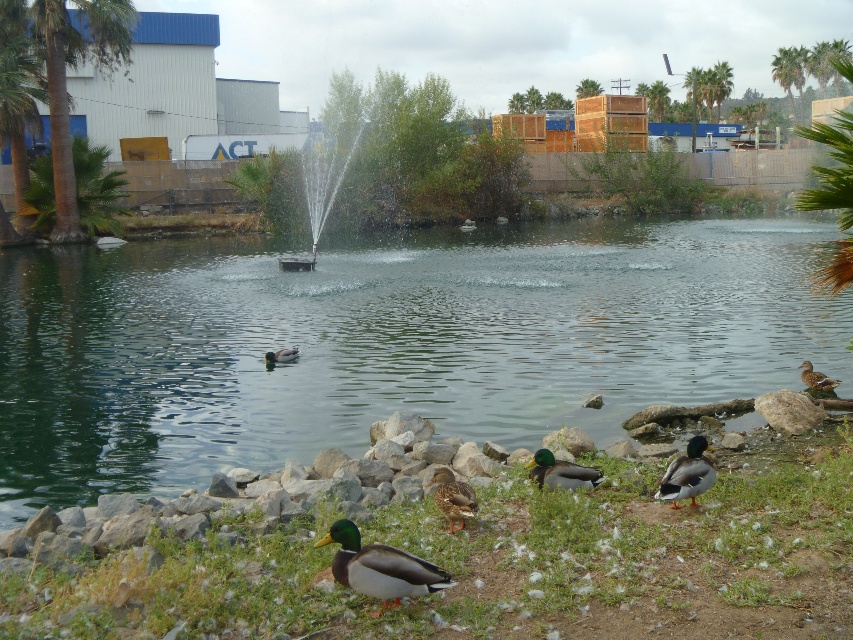
Question: Can you confirm if green grass at lower center is wider than brown matte duck at center?

Choices:
 (A) yes
 (B) no

Answer: (A)

Question: Estimate the real-world distances between objects in this image. Which object is farther from the brown matte duck at lower right?

Choices:
 (A) green leafy palm tree at left
 (B) green matte duck at center
 (C) green leafy palm tree at upper right
 (D) green leafy palm tree at upper left

Answer: (C)

Question: Where is green leafy palm tree at upper left located in relation to green matte duck at center in the image?

Choices:
 (A) below
 (B) above

Answer: (B)

Question: Which of these objects is positioned farthest from the green grass at lower center?

Choices:
 (A) green leafy palm tree at upper left
 (B) brown matte duck at center
 (C) clear water at center

Answer: (A)

Question: Does green leafy palm tree at upper left have a greater width compared to green glossy duck at center?

Choices:
 (A) no
 (B) yes

Answer: (B)

Question: Which of the following is the farthest from the observer?

Choices:
 (A) (717, 225)
 (B) (688, 456)

Answer: (A)